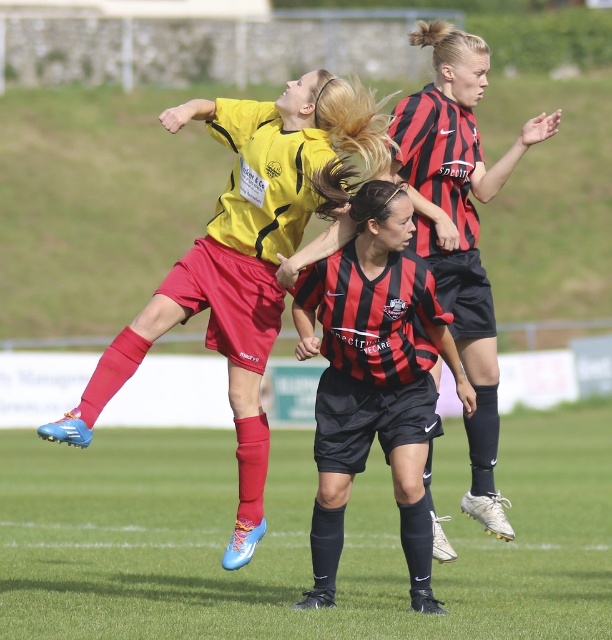
Question: Is black matte soccer jersey at center positioned behind black and red striped jersey at upper right?

Choices:
 (A) no
 (B) yes

Answer: (B)

Question: Based on their relative distances, which object is farther from the black matte soccer jersey at center?

Choices:
 (A) matte yellow jersey at upper center
 (B) grass turf football field at center

Answer: (B)

Question: Is black matte soccer jersey at center to the right of black and red striped jersey at upper right from the viewer's perspective?

Choices:
 (A) no
 (B) yes

Answer: (A)

Question: Which point is closer to the camera taking this photo?

Choices:
 (A) (428, 592)
 (B) (285, 164)
 (C) (170, 444)
 (D) (457, 83)

Answer: (B)

Question: Is black matte soccer jersey at center thinner than black and red striped jersey at upper right?

Choices:
 (A) yes
 (B) no

Answer: (B)

Question: Which of the following is the closest to the observer?

Choices:
 (A) black and red striped jersey at upper right
 (B) black matte soccer jersey at center
 (C) matte yellow jersey at upper center
 (D) grass turf football field at center

Answer: (C)